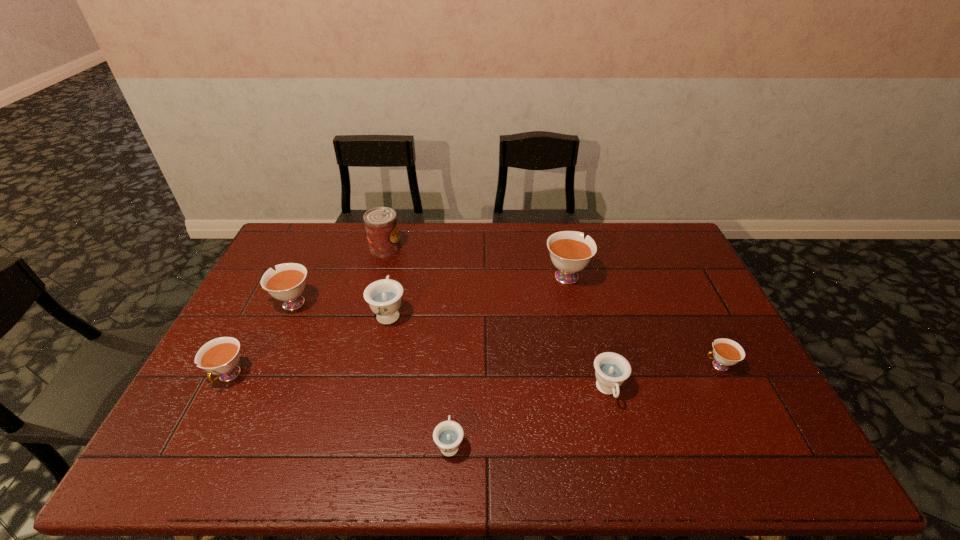
Identify the location of the smallest white teacup. Image resolution: width=960 pixels, height=540 pixels. (726, 352).

Where is `the smallest blue teacup`? The image size is (960, 540). the smallest blue teacup is located at coordinates coord(448,435).

Find the location of `the second blue teacup from right to left`. the second blue teacup from right to left is located at coordinates point(448,435).

Identify the location of vacant space situated on the right of the can. (471, 247).

This screenshot has width=960, height=540. What are the coordinates of `vacant area located on the side of the biggest white teacup with the handle` in the screenshot? It's located at (560, 246).

I want to click on vacant region located on the side of the biggest white teacup with the handle, so click(560, 248).

You are a GUI agent. You are given a task and a screenshot of the screen. Output one action in this format:
    pyautogui.click(x=<x>, y=<y>)
    Task: Click on the vacant area located 0.130m on the side of the biggest white teacup with the handle
    This screenshot has width=960, height=540.
    Given the screenshot: What is the action you would take?
    pyautogui.click(x=558, y=237)

At what (x,y) coordinates should I click in order to perform the action: click on vacant space located 0.060m on the side of the third smallest white teacup with the handle. Please return your answer as a coordinate pair (x, y). This screenshot has height=540, width=960. Looking at the image, I should click on (248, 303).

Image resolution: width=960 pixels, height=540 pixels. What are the coordinates of `vacant area situated 0.140m on the side of the third teacup from left to right with the handle` in the screenshot? It's located at (398, 268).

Find the location of `blank area located on the side of the third teacup from left to right with the handle`. blank area located on the side of the third teacup from left to right with the handle is located at coordinates (403, 245).